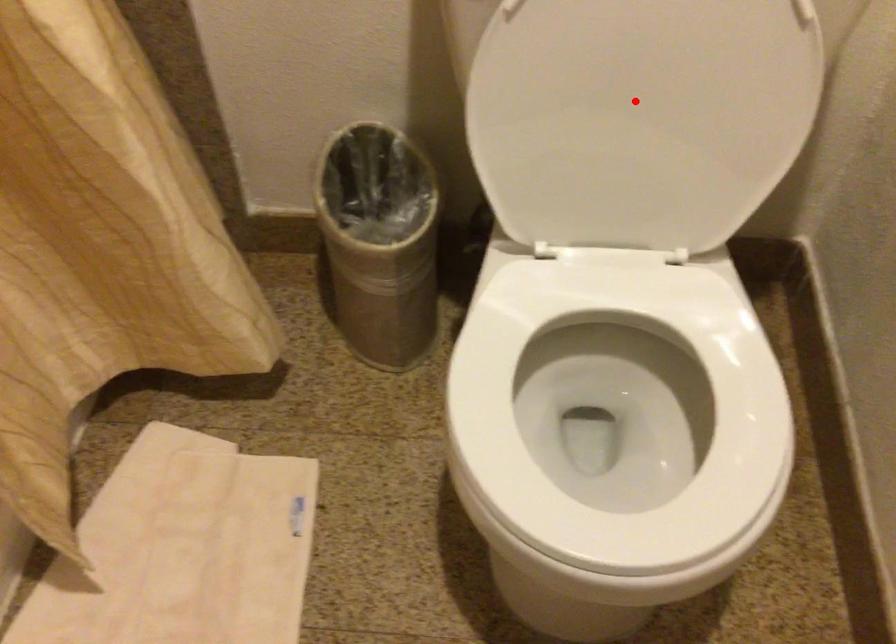
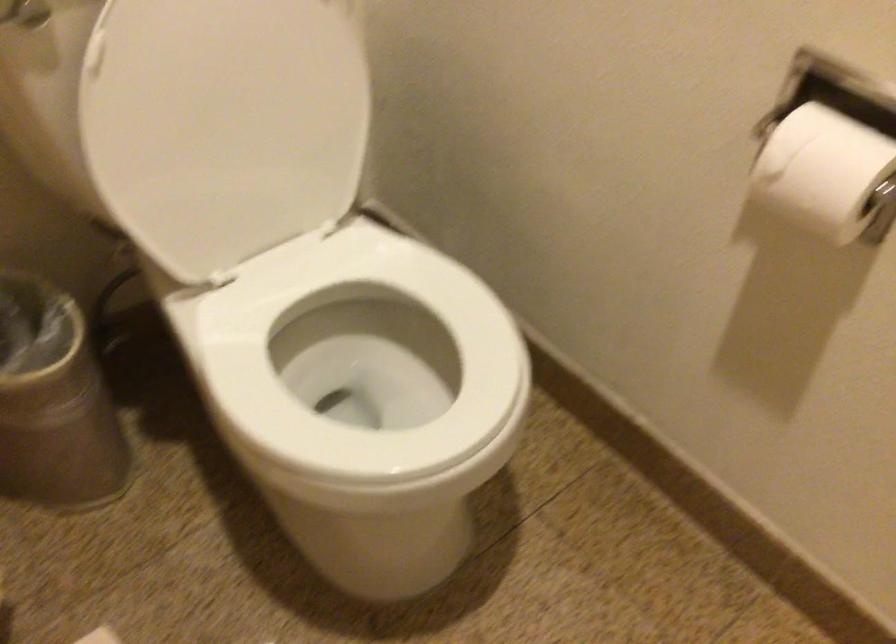
Question: I am providing you with two images of the same scene from different viewpoints. Image1 has a red point marked. In image2, the corresponding 3D location appears at what relative position? Reply with the corresponding letter.

Choices:
 (A) Closer
 (B) Farther

Answer: (B)